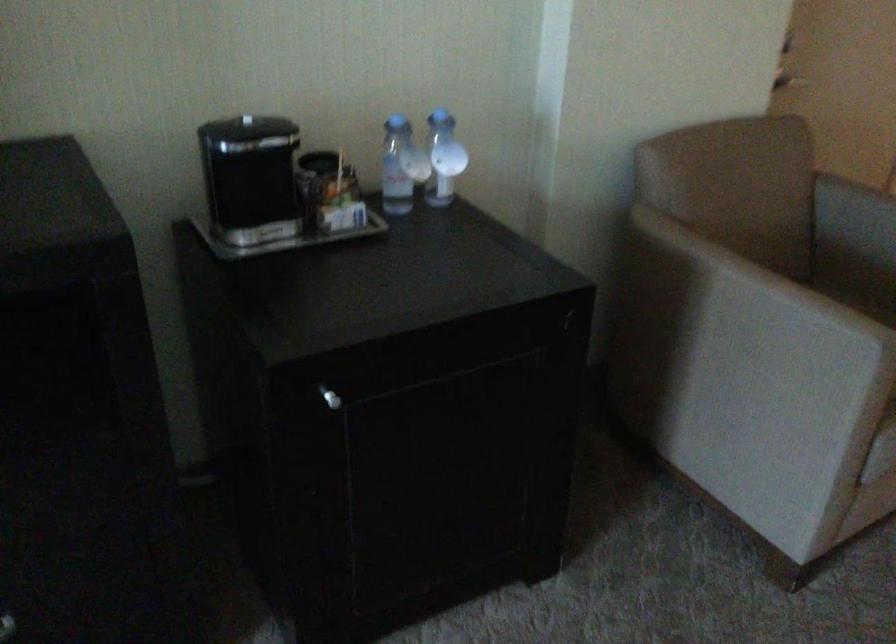
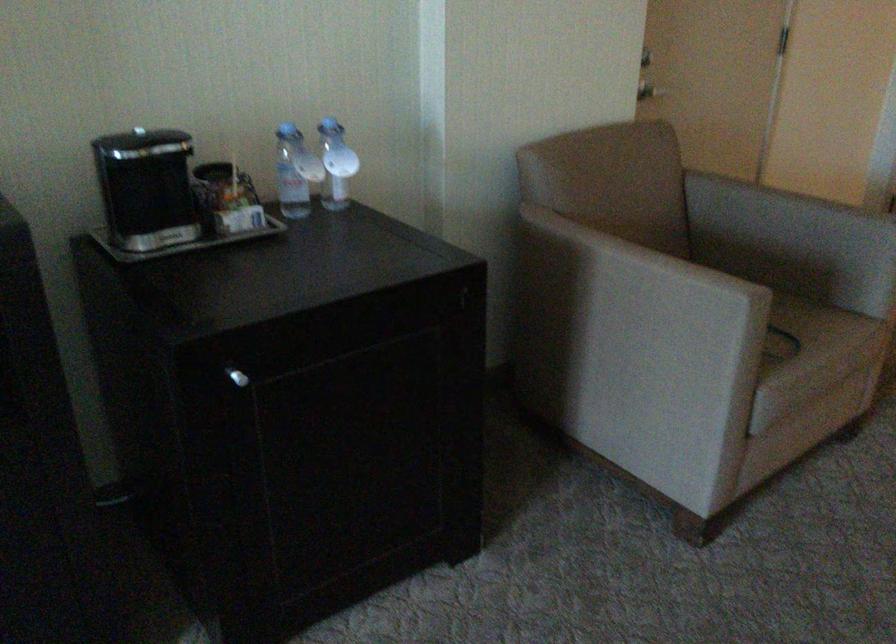
The point at (785, 84) is marked in the first image. Where is the corresponding point in the second image?

(649, 90)